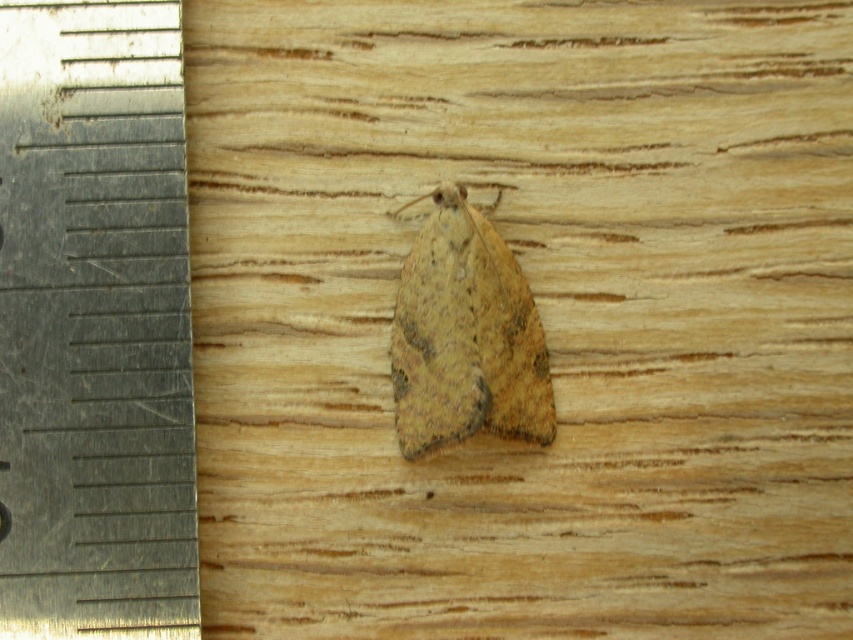
Question: Is metallic silver ruler at left further to the viewer compared to brown textured moth at center?

Choices:
 (A) yes
 (B) no

Answer: (B)

Question: Which object is farther from the camera taking this photo?

Choices:
 (A) brown textured moth at center
 (B) metallic silver ruler at left

Answer: (A)

Question: Does metallic silver ruler at left appear over brown textured moth at center?

Choices:
 (A) yes
 (B) no

Answer: (A)

Question: Among these objects, which one is farthest from the camera?

Choices:
 (A) brown textured moth at center
 (B) metallic silver ruler at left

Answer: (A)

Question: Considering the relative positions of metallic silver ruler at left and brown textured moth at center in the image provided, where is metallic silver ruler at left located with respect to brown textured moth at center?

Choices:
 (A) below
 (B) above

Answer: (B)